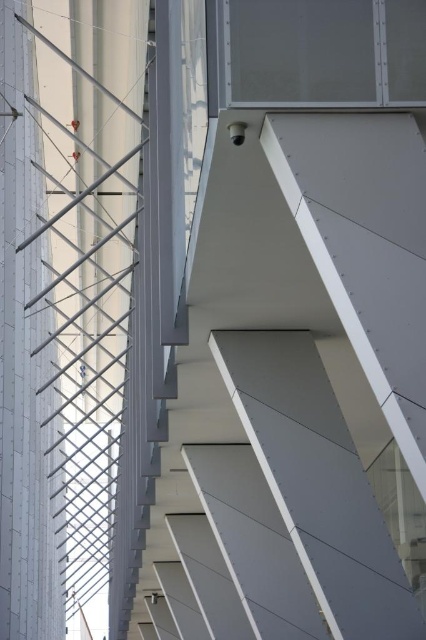
Is point (226, 410) behind point (25, 483)?

No, it is in front of (25, 483).

Does white smooth stair at upper center have a lesser width compared to white matte pillar at left?

Incorrect, white smooth stair at upper center's width is not less than white matte pillar at left's.

The image size is (426, 640). I want to click on white smooth stair at upper center, so click(x=308, y=355).

Locate an element on the screen. The width and height of the screenshot is (426, 640). white smooth stair at upper center is located at coordinates (308, 355).